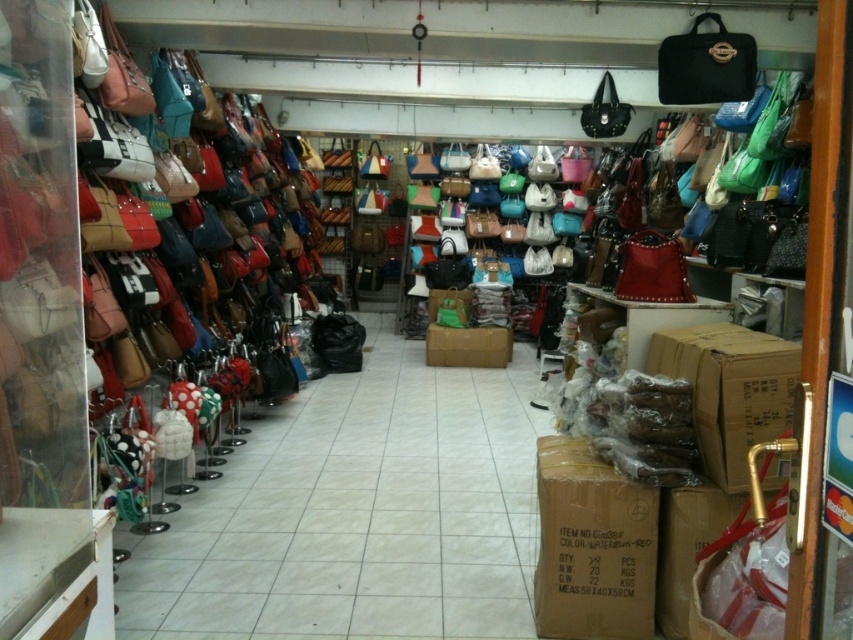
You are a delivery person who just arrived at the retail store. You need to place a waterproof cardboard box at center in the middle of the store. According to the store layout, where should you place it?

The waterproof cardboard box at center should be placed at point (592, 547).

You are a delivery person who just arrived at the retail store. You need to place a new handbag that is 30 cm wide onto a box. The waterproof cardboard box at center and the brown cardboard box at lower right are available. Which box should you choose to ensure the handbag fits properly?

The waterproof cardboard box at center has a larger width than the brown cardboard box at lower right, so the handbag that is 30 cm wide will fit better in the waterproof cardboard box at center.